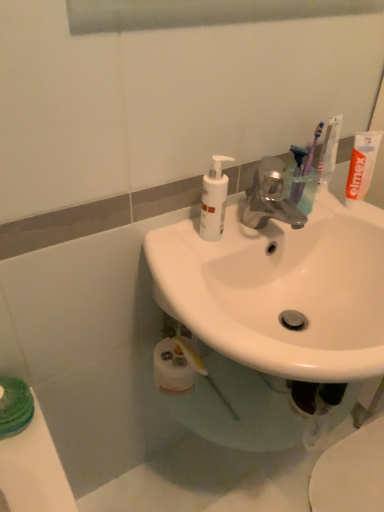
Question: Is translucent plastic toothbrush at upper right, placed as the first toothbrush when sorted from left to right, wider or thinner than white matte toothpaste at upper right?

Choices:
 (A) thin
 (B) wide

Answer: (A)

Question: Do you think translucent plastic toothbrush at upper right, placed as the first toothbrush when sorted from left to right, is within white matte toothpaste at upper right, or outside of it?

Choices:
 (A) outside
 (B) inside

Answer: (A)

Question: Which of these objects is positioned closest to the white glossy toilet at lower right?

Choices:
 (A) purple plastic toothbrush at upper right, which appears as the 2th toothbrush when viewed from the left
 (B) translucent plastic toothbrush at upper right, positioned as the third toothbrush in right-to-left order
 (C) white matte toothpaste at upper right
 (D) white matte pump bottle at upper center
 (E) purple plastic toothbrush at upper right, acting as the 3th toothbrush starting from the left

Answer: (C)

Question: Which is farther from the purple plastic toothbrush at upper right, the 1th toothbrush from the right?

Choices:
 (A) translucent plastic toothbrush at upper right, placed as the first toothbrush when sorted from left to right
 (B) white matte pump bottle at upper center
 (C) purple plastic toothbrush at upper right, which appears as the 2th toothbrush when viewed from the left
 (D) white matte toothpaste at upper right
 (E) white glossy toilet at lower right

Answer: (E)